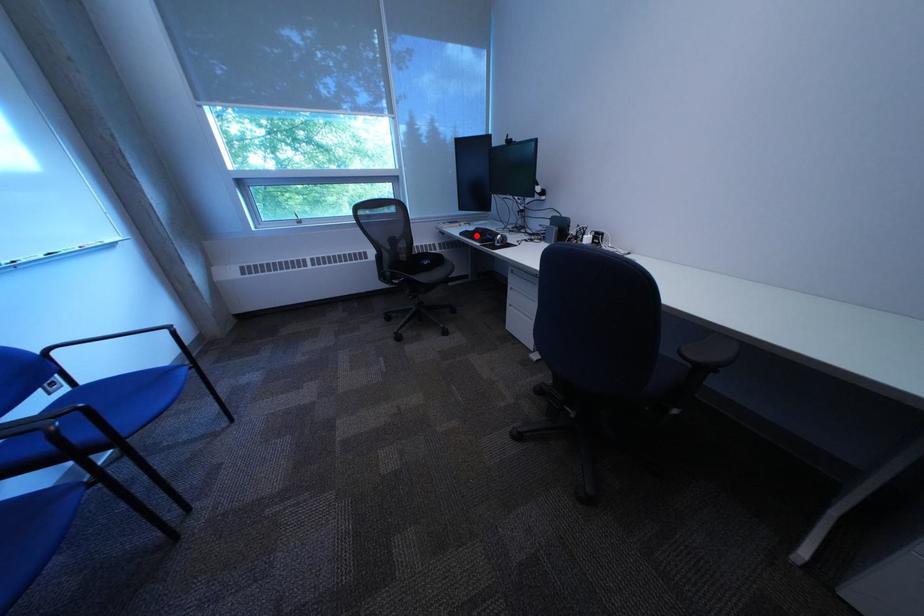
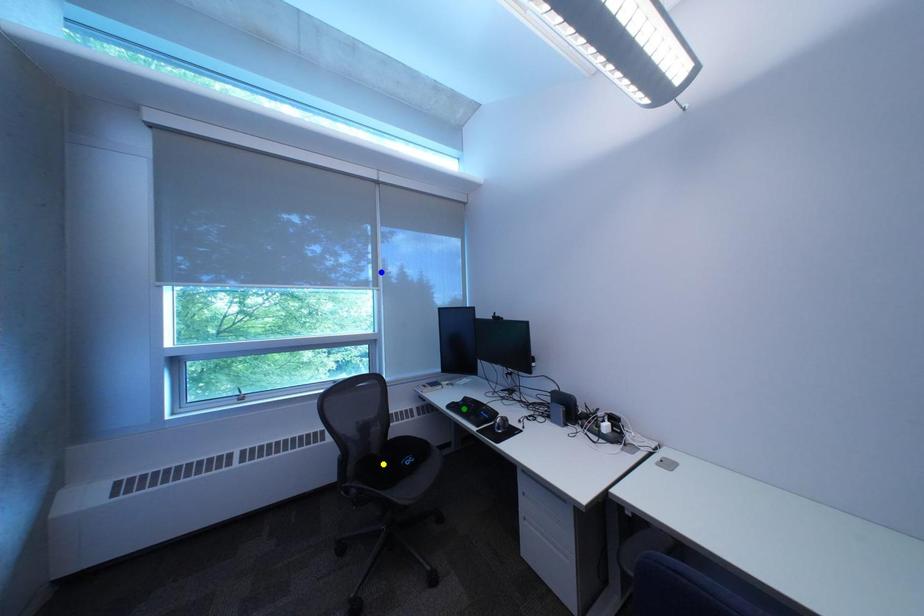
Question: I am providing you with two images of the same scene from different viewpoints. A red point is marked on the first image. You are given multiple points on the second image. In image 2, which mark is for the same physical point as the one in image 1?

Choices:
 (A) green point
 (B) blue point
 (C) yellow point

Answer: (A)